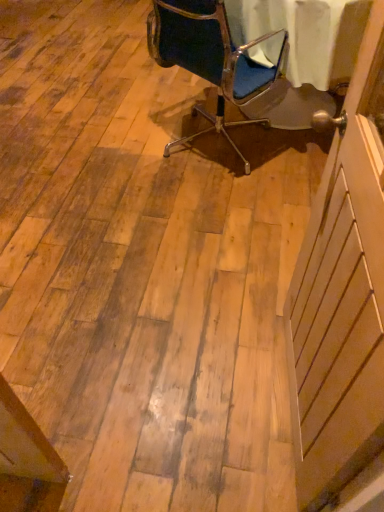
Question: Would you say blue fabric chair at upper center contains white wood screen door at right?

Choices:
 (A) no
 (B) yes

Answer: (A)

Question: Does blue fabric chair at upper center come behind white wood screen door at right?

Choices:
 (A) yes
 (B) no

Answer: (A)

Question: Can you confirm if blue fabric chair at upper center is positioned to the right of white wood screen door at right?

Choices:
 (A) yes
 (B) no

Answer: (B)

Question: Considering the relative sizes of blue fabric chair at upper center and white wood screen door at right in the image provided, is blue fabric chair at upper center taller than white wood screen door at right?

Choices:
 (A) yes
 (B) no

Answer: (B)

Question: Is blue fabric chair at upper center facing away from white wood screen door at right?

Choices:
 (A) no
 (B) yes

Answer: (A)

Question: Can you confirm if blue fabric chair at upper center is shorter than white wood screen door at right?

Choices:
 (A) yes
 (B) no

Answer: (A)

Question: From the image's perspective, is white wood screen door at right above blue fabric chair at upper center?

Choices:
 (A) yes
 (B) no

Answer: (B)

Question: Does white wood screen door at right turn towards blue fabric chair at upper center?

Choices:
 (A) no
 (B) yes

Answer: (A)

Question: Considering the relative sizes of white wood screen door at right and blue fabric chair at upper center in the image provided, is white wood screen door at right taller than blue fabric chair at upper center?

Choices:
 (A) yes
 (B) no

Answer: (A)

Question: Is white wood screen door at right to the left of blue fabric chair at upper center from the viewer's perspective?

Choices:
 (A) no
 (B) yes

Answer: (A)

Question: Is white wood screen door at right smaller than blue fabric chair at upper center?

Choices:
 (A) yes
 (B) no

Answer: (A)

Question: Is white wood screen door at right bigger than blue fabric chair at upper center?

Choices:
 (A) no
 (B) yes

Answer: (A)

Question: Considering the positions of blue fabric chair at upper center and white wood screen door at right in the image, is blue fabric chair at upper center taller or shorter than white wood screen door at right?

Choices:
 (A) tall
 (B) short

Answer: (B)